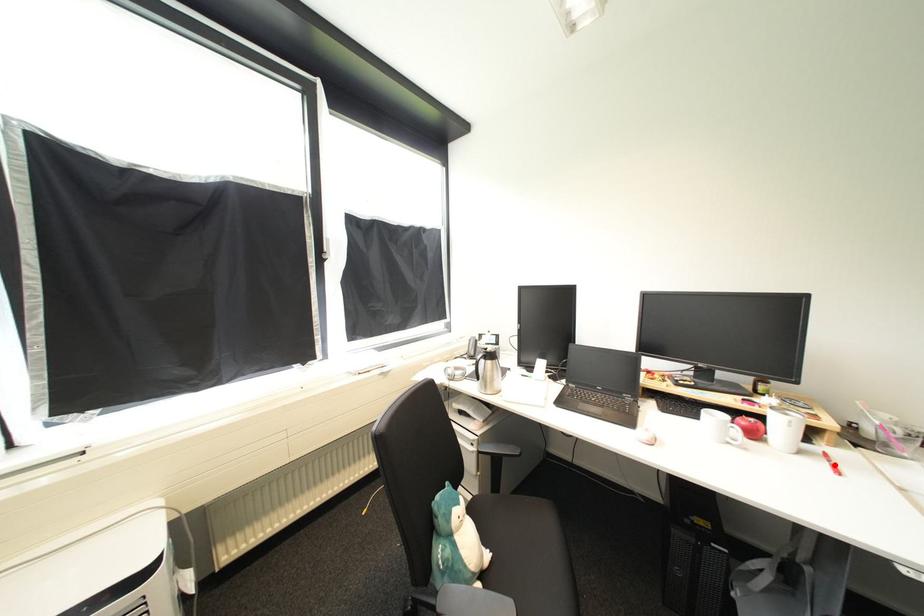
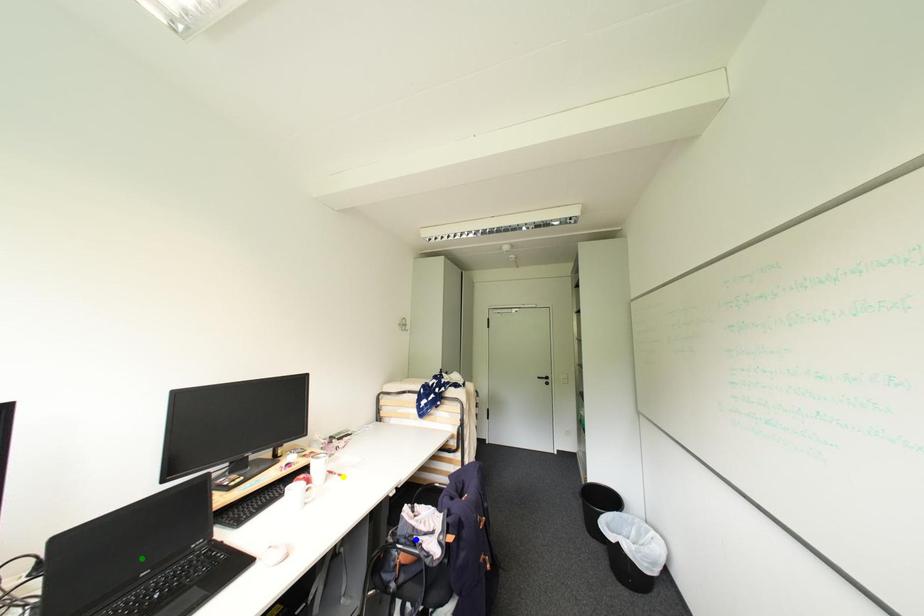
Question: I am providing you with two images of the same scene from different viewpoints. A red point is marked on the first image. You are given multiple points on the second image. Which mark in image 2 goes with the point in image 1?

Choices:
 (A) blue point
 (B) yellow point
 (C) green point

Answer: (B)